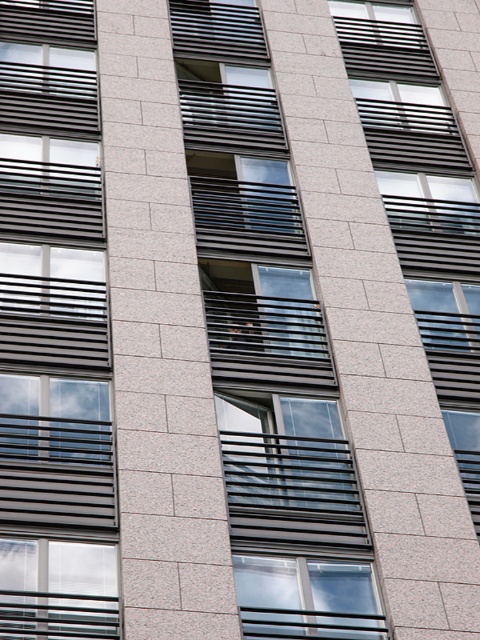
Consider the image. Between clear glass window at lower left and clear glass window at center, which one has more height?

clear glass window at center

Who is more distant from viewer, (83,614) or (289,636)?

The point (289,636) is more distant.

This screenshot has width=480, height=640. Describe the element at coordinates (58, 589) in the screenshot. I see `clear glass window at lower left` at that location.

The image size is (480, 640). I want to click on clear glass window at lower left, so click(58, 589).

Identify the location of matte black window at center. (267, 348).

You are a GUI agent. You are given a task and a screenshot of the screen. Output one action in this format:
    pyautogui.click(x=<x>, y=<y>)
    Task: Click on the matte black window at center
    The width and height of the screenshot is (480, 640).
    Given the screenshot: What is the action you would take?
    pyautogui.click(x=267, y=348)

Which is behind, point (66, 26) or point (356, 596)?

Point (66, 26)

Does matte black window at left have a smaller size compared to clear glass window at center?

Actually, matte black window at left might be larger than clear glass window at center.

Between point (81, 413) and point (361, 612), which one is positioned in front?

Positioned in front is point (361, 612).

Find the location of a particular element. This screenshot has height=640, width=480. matte black window at left is located at coordinates (54, 330).